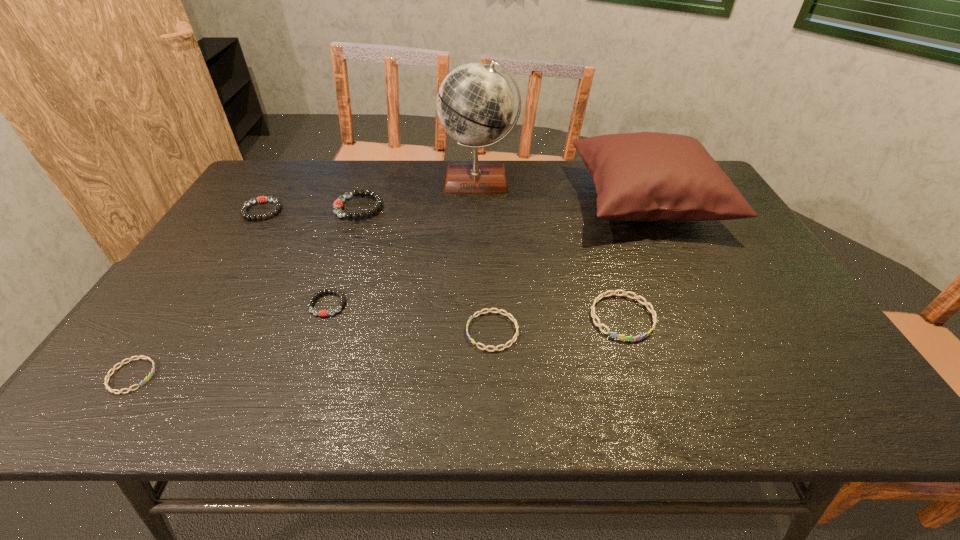
Find the location of a particular element. vacant point that satisfies the following two spatial constraints: 1. on the back side of the smallest black bracelet; 2. on the right side of the second tallest object is located at coordinates (364, 201).

At what (x,y) coordinates should I click in order to perform the action: click on vacant area that satisfies the following two spatial constraints: 1. on the surface of the rightmost bracelet showing star-shaped elements; 2. on the surface of the second bracelet from right to left showing star-shaped elements. Please return your answer as a coordinate pair (x, y). This screenshot has width=960, height=540. Looking at the image, I should click on coord(627,332).